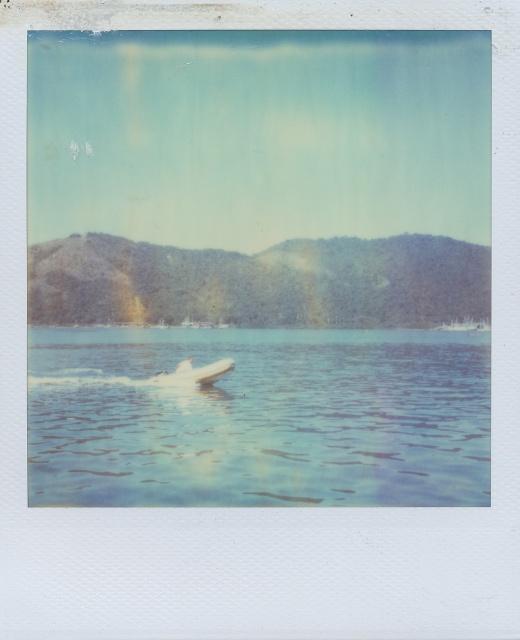
Question: Is clear blue water at center closer to the viewer compared to white glossy boat at center?

Choices:
 (A) no
 (B) yes

Answer: (B)

Question: Does clear blue water at center have a lesser width compared to white glossy boat at center?

Choices:
 (A) yes
 (B) no

Answer: (B)

Question: Which of the following is the farthest from the observer?

Choices:
 (A) (156, 384)
 (B) (271, 360)

Answer: (B)

Question: From the image, what is the correct spatial relationship of clear blue water at center in relation to white glossy boat at center?

Choices:
 (A) above
 (B) below

Answer: (A)